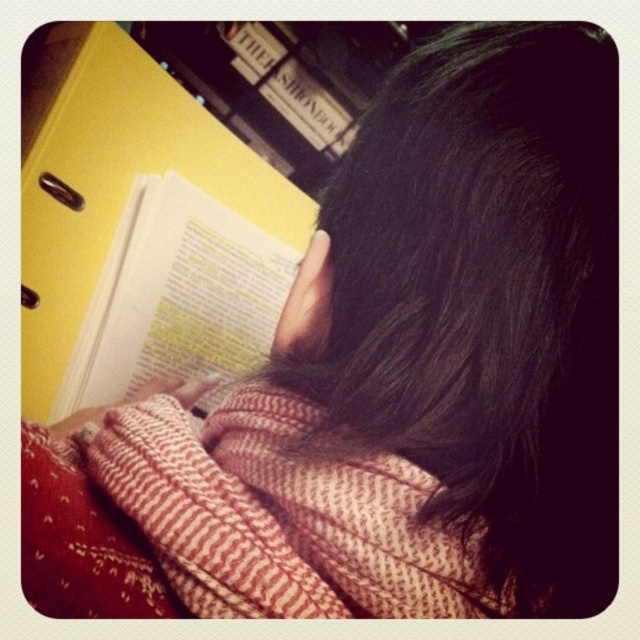
Question: Which point is farther to the camera?

Choices:
 (A) dark brown hair at upper center
 (B) white paper book at upper left

Answer: (B)

Question: Which of the following is the farthest from the observer?

Choices:
 (A) dark brown hair at upper center
 (B) white paper book at upper left

Answer: (B)

Question: Does dark brown hair at upper center appear on the right side of white paper book at upper left?

Choices:
 (A) yes
 (B) no

Answer: (A)

Question: Can you confirm if dark brown hair at upper center is positioned above white paper book at upper left?

Choices:
 (A) yes
 (B) no

Answer: (A)

Question: Which object appears farthest from the camera in this image?

Choices:
 (A) dark brown hair at upper center
 (B) white paper book at upper left

Answer: (B)

Question: Is dark brown hair at upper center thinner than white paper book at upper left?

Choices:
 (A) no
 (B) yes

Answer: (B)